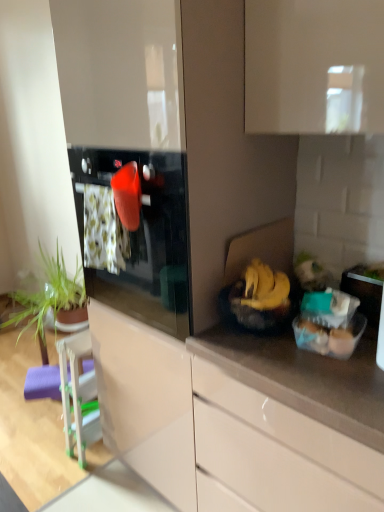
Question: Can you confirm if glossy white cabinet at lower center is smaller than clear plastic container at right, arranged as the first appliance when viewed from the top?

Choices:
 (A) no
 (B) yes

Answer: (A)

Question: Considering the relative sizes of glossy white cabinet at lower center and clear plastic container at right, placed as the 1th appliance when sorted from front to back, in the image provided, is glossy white cabinet at lower center thinner than clear plastic container at right, placed as the 1th appliance when sorted from front to back,?

Choices:
 (A) yes
 (B) no

Answer: (B)

Question: Would you say glossy white cabinet at lower center contains clear plastic container at right, the 2th appliance ordered from the bottom?

Choices:
 (A) yes
 (B) no

Answer: (B)

Question: Is glossy white cabinet at lower center closer to the viewer compared to clear plastic container at right, placed as the 1th appliance when sorted from front to back?

Choices:
 (A) no
 (B) yes

Answer: (B)

Question: Is glossy white cabinet at lower center bigger than clear plastic container at right, marked as the 1th appliance in a right-to-left arrangement?

Choices:
 (A) no
 (B) yes

Answer: (B)

Question: Is glossy white cabinet at lower center positioned beyond the bounds of clear plastic container at right, placed as the 1th appliance when sorted from front to back?

Choices:
 (A) no
 (B) yes

Answer: (B)

Question: From the image's perspective, is yellow matte bananas at right below purple foam bar stool at lower left?

Choices:
 (A) no
 (B) yes

Answer: (A)

Question: Are yellow matte bananas at right and purple foam bar stool at lower left located far from each other?

Choices:
 (A) yes
 (B) no

Answer: (A)

Question: From a real-world perspective, is yellow matte bananas at right on top of purple foam bar stool at lower left?

Choices:
 (A) yes
 (B) no

Answer: (A)

Question: From the image's perspective, would you say yellow matte bananas at right is positioned over purple foam bar stool at lower left?

Choices:
 (A) yes
 (B) no

Answer: (A)

Question: Is yellow matte bananas at right to the left of purple foam bar stool at lower left from the viewer's perspective?

Choices:
 (A) yes
 (B) no

Answer: (B)

Question: Is yellow matte bananas at right taller than purple foam bar stool at lower left?

Choices:
 (A) yes
 (B) no

Answer: (B)

Question: Is glossy black oven at center facing away from green leafy plant at left?

Choices:
 (A) yes
 (B) no

Answer: (B)